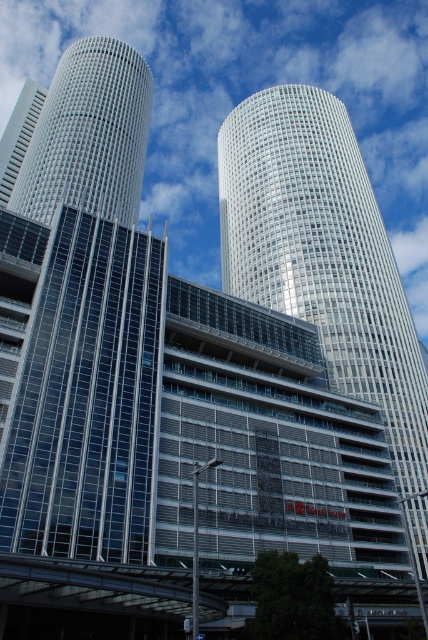
Question: Considering the real-world distances, which object is farthest from the silver glass tower at center?

Choices:
 (A) matte glass skyscraper at center
 (B) matte glass skyscraper at upper left

Answer: (B)

Question: Estimate the real-world distances between objects in this image. Which object is farther from the matte glass skyscraper at upper left?

Choices:
 (A) matte glass skyscraper at center
 (B) silver glass tower at center

Answer: (B)

Question: Based on their relative distances, which object is nearer to the silver glass tower at center?

Choices:
 (A) matte glass skyscraper at center
 (B) matte glass skyscraper at upper left

Answer: (A)

Question: Is silver glass tower at center smaller than matte glass skyscraper at center?

Choices:
 (A) no
 (B) yes

Answer: (A)

Question: Is silver glass tower at center closer to camera compared to matte glass skyscraper at upper left?

Choices:
 (A) no
 (B) yes

Answer: (B)

Question: Where is silver glass tower at center located in relation to matte glass skyscraper at center in the image?

Choices:
 (A) below
 (B) above

Answer: (A)